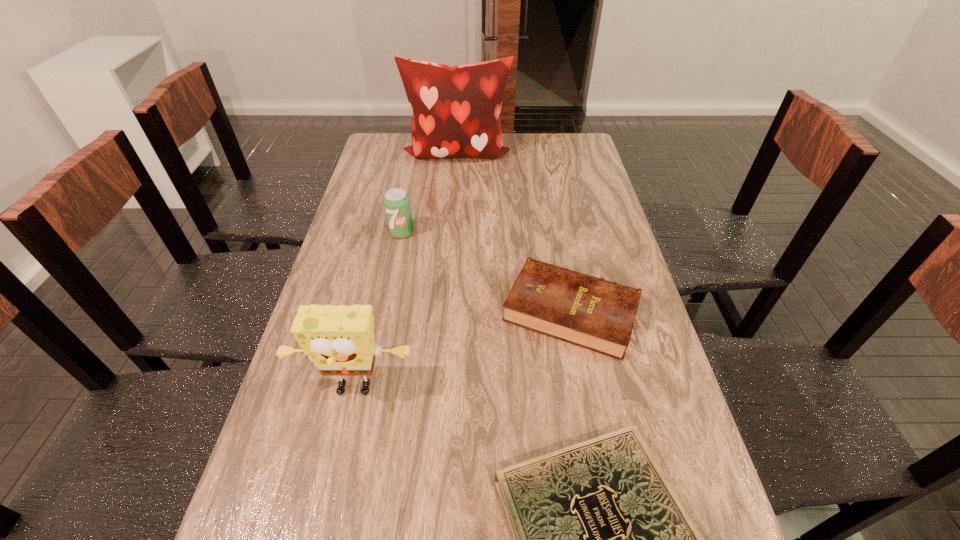
The width and height of the screenshot is (960, 540). Find the location of `vacant space situated 0.380m on the back of the second farthest object`. vacant space situated 0.380m on the back of the second farthest object is located at coordinates (416, 162).

Where is `free space located 0.280m on the back of the taller hardback book`? free space located 0.280m on the back of the taller hardback book is located at coordinates point(552,211).

The width and height of the screenshot is (960, 540). Identify the location of object that is at the far edge. (456, 109).

Identify the location of cushion that is at the left edge. The height and width of the screenshot is (540, 960). (456, 109).

This screenshot has height=540, width=960. Identify the location of sponge that is at the left edge. (339, 340).

This screenshot has width=960, height=540. Find the location of `soda that is at the left edge`. soda that is at the left edge is located at coordinates (396, 202).

Identify the location of object positioned at the right edge. This screenshot has width=960, height=540. (590, 312).

Find the location of a particular element. This screenshot has width=960, height=540. object situated at the far left corner is located at coordinates [x=456, y=109].

The width and height of the screenshot is (960, 540). In order to click on vacant region at the left edge in this screenshot , I will do `click(247, 514)`.

Identify the location of free space at the right edge of the desktop. (617, 266).